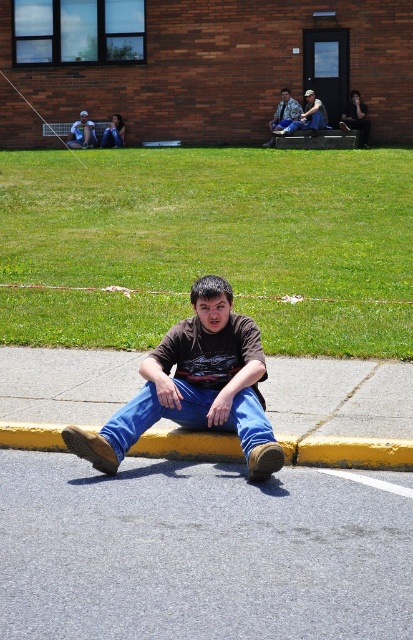
Which of these two, yellow painted curb at lower center or matte black jacket at upper left, stands taller?

With more height is matte black jacket at upper left.

Between yellow painted curb at lower center and matte black jacket at upper left, which one is positioned lower?

Positioned lower is yellow painted curb at lower center.

Is point (185, 451) positioned behind point (66, 140)?

That is False.

Locate an element on the screen. Image resolution: width=413 pixels, height=640 pixels. yellow painted curb at lower center is located at coordinates (348, 452).

How distant is gray asphalt at lower center from brown matte shirt at center?

A distance of 31.14 inches exists between gray asphalt at lower center and brown matte shirt at center.

Which is more to the right, gray asphalt at lower center or brown matte shirt at center?

gray asphalt at lower center is more to the right.

This screenshot has width=413, height=640. Describe the element at coordinates (201, 552) in the screenshot. I see `gray asphalt at lower center` at that location.

This screenshot has width=413, height=640. In order to click on gray asphalt at lower center in this screenshot , I will do `click(201, 552)`.

Can you confirm if blue denim jeans at center is thinner than matte black jacket at upper left?

In fact, blue denim jeans at center might be wider than matte black jacket at upper left.

Is blue denim jeans at center shorter than matte black jacket at upper left?

Yes, blue denim jeans at center is shorter than matte black jacket at upper left.

What do you see at coordinates (187, 417) in the screenshot?
I see `blue denim jeans at center` at bounding box center [187, 417].

Identify the location of blue denim jeans at center. The width and height of the screenshot is (413, 640). (187, 417).